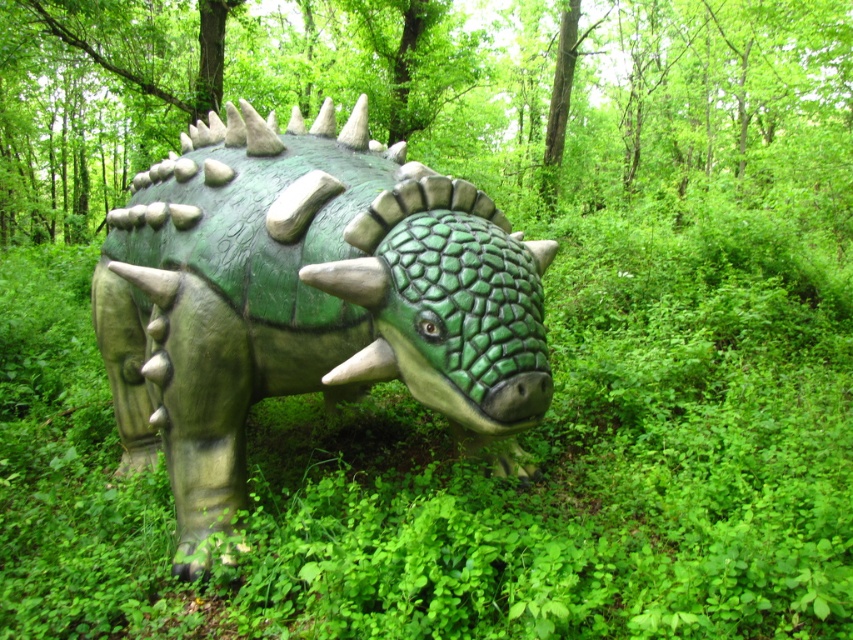
You are standing in the forest and want to take a photo of the green matte textured dinosaur at center. However, there is green matte grass at center in the way. Can you see the dinosaur clearly through the grass?

The green matte grass at center is further to the viewer than the green matte textured dinosaur at center, so the grass is closer to you and would block your view of the dinosaur behind it.

Consider the image. You are a hiker who wants to take a photo of the green matte textured dinosaur at center without getting too close. You have a camera with a zoom lens that can focus up to 2 meters away. Can you take the photo from where you are standing, which is 1.99 meters away from the green matte grass at center?

The green matte grass at center is 1.99 meters from the green matte textured dinosaur at center. Since you are standing 1.99 meters away from the grass, your distance to the dinosaur would be approximately 1.99 meters plus the distance between you and the grass. However, the exact distance to the dinosaur isn

In the scene shown: You are a gardener planning to place a new flower bed between the green matte grass at center and the green matte textured dinosaur at center. Since the flower bed requires a minimum space of 2 meters, can you determine if there is enough space between them based on their widths?

The green matte grass at center is narrower than the green matte textured dinosaur at center. However, the exact widths are not provided, so it is impossible to determine if the space between them meets the 2 meter requirement without additional measurements.